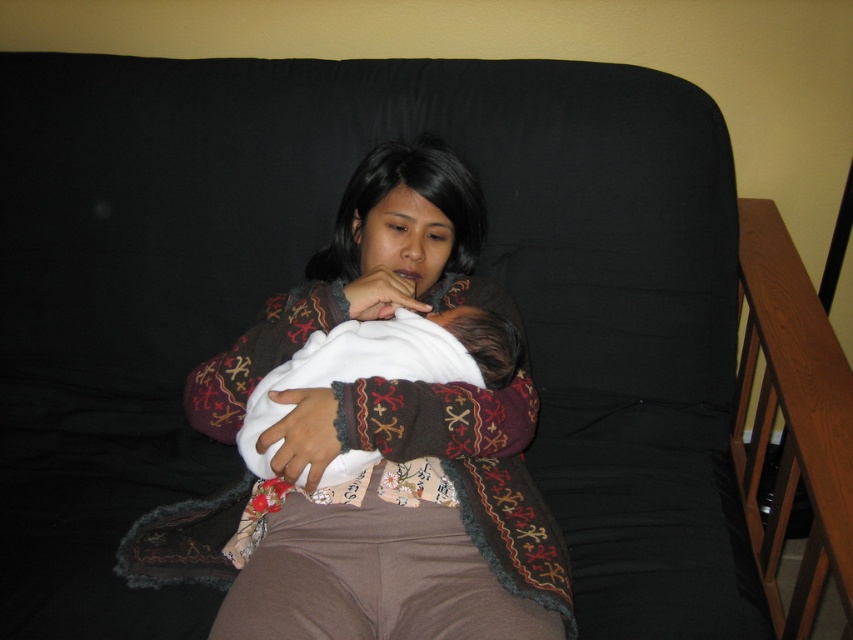
Question: In this image, where is brown textured sweater at center located relative to white soft baby at center?

Choices:
 (A) right
 (B) left

Answer: (B)

Question: Which object is closer to the camera taking this photo?

Choices:
 (A) brown textured sweater at center
 (B) white soft baby at center

Answer: (A)

Question: Which object is farther from the camera taking this photo?

Choices:
 (A) brown textured sweater at center
 (B) white soft baby at center

Answer: (B)

Question: Observing the image, what is the correct spatial positioning of brown textured sweater at center in reference to white soft baby at center?

Choices:
 (A) above
 (B) below

Answer: (A)

Question: Among these points, which one is nearest to the camera?

Choices:
 (A) click(x=270, y=564)
 (B) click(x=514, y=355)

Answer: (A)

Question: Observing the image, what is the correct spatial positioning of brown textured sweater at center in reference to white soft baby at center?

Choices:
 (A) above
 (B) below

Answer: (A)